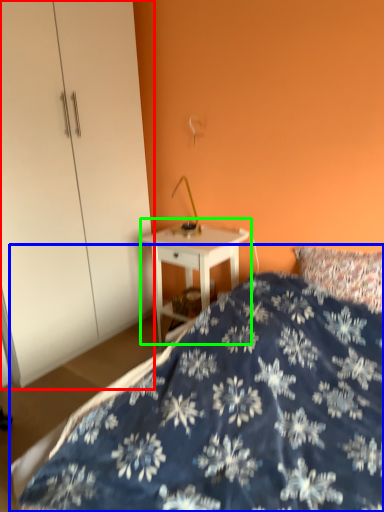
Question: Considering the real-world distances, which object is farthest from dresser (highlighted by a red box)? bed (highlighted by a blue box) or nightstand (highlighted by a green box)?

Choices:
 (A) bed
 (B) nightstand

Answer: (A)